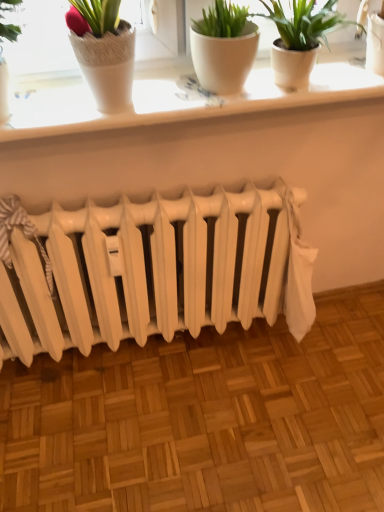
At what (x,y) coordinates should I click in order to perform the action: click on free space to the right of white matte radiator at center. Please return your answer as a coordinate pair (x, y). Looking at the image, I should click on (296, 380).